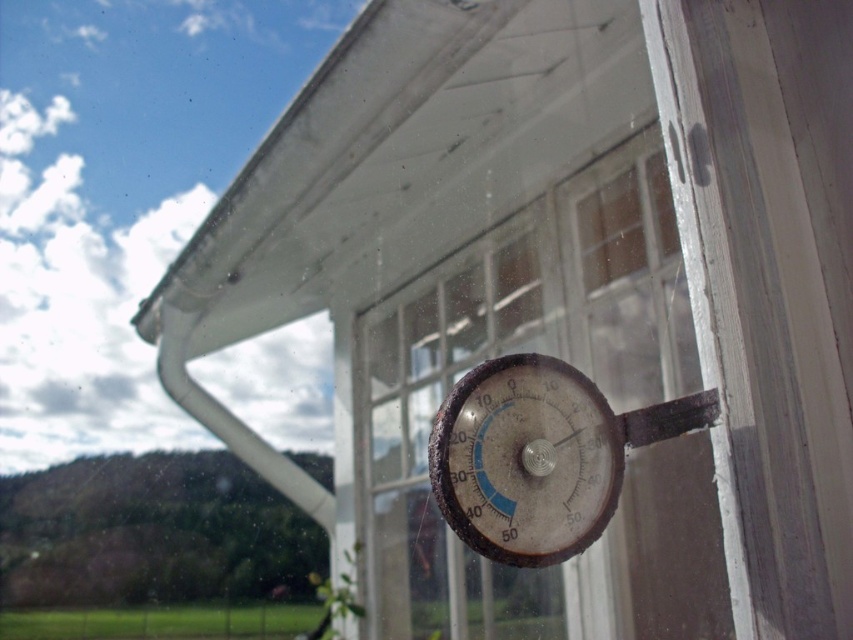
Which is in front, point (701, 545) or point (552, 417)?

Point (552, 417)

Who is lower down, transparent glass thermometer at center or rusty metal thermometer at center?

rusty metal thermometer at center is below.

Who is more forward, (695, 508) or (524, 416)?

Point (524, 416) is more forward.

I want to click on transparent glass thermometer at center, so coord(587,376).